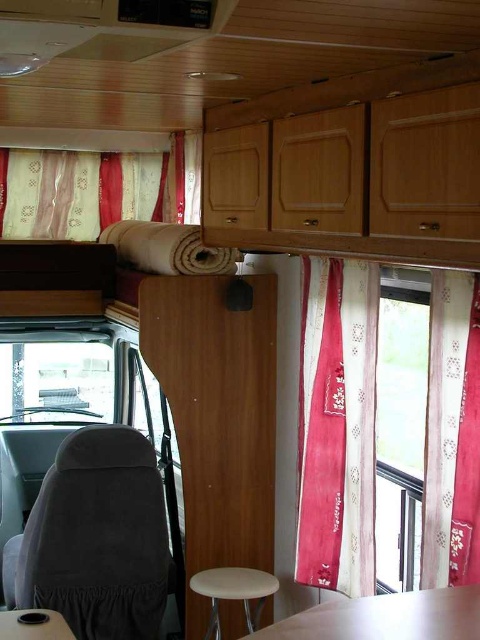
You are trying to move a rectangular box that is 1.2 meters wide into the vehicle. The box needs to fit between the gray fabric chair at lower left and the pink fabric curtain at center. Can the box fit through this space?

The gray fabric chair at lower left might be wider than the pink fabric curtain at center. Since the box is 1.2 meters wide, it depends on the actual width of the chair and curtain. If the chair is wider, the space between them may not be sufficient. However, without exact measurements, we cannot confirm for certain.

You are a delivery person who needs to place a package between the gray fabric chair at lower left and the white seat stool at lower right. The package is 2 meters long. Will it fit between them?

The distance between the gray fabric chair at lower left and the white seat stool at lower right is 2.42 meters. Since the package is 2 meters long, it will fit between them with some space to spare.

You are sitting in the compact vehicle and want to know where the gray fabric chair at lower left is located. Can you describe its position relative to the point at coordinates (96, 538)?

The gray fabric chair at lower left is located exactly at the point with coordinates (96, 538).